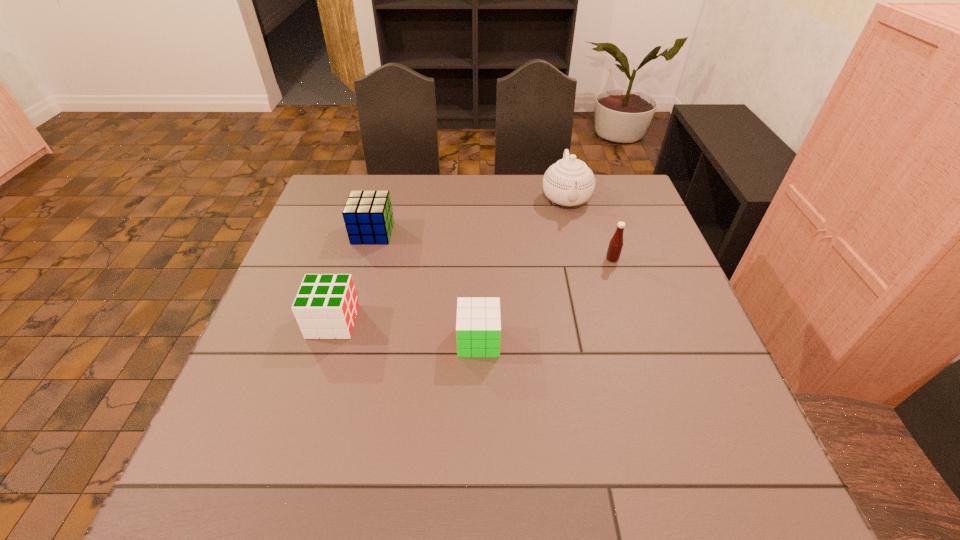
The image size is (960, 540). Find the location of `vacant area that lies between the chinaware and the third object from right to left`. vacant area that lies between the chinaware and the third object from right to left is located at coordinates (522, 269).

This screenshot has height=540, width=960. In order to click on free space that is in between the third nearest object and the rightmost cube in this screenshot , I will do (x=545, y=300).

Where is `vacant space in between the second farthest object and the farthest object`? Image resolution: width=960 pixels, height=540 pixels. vacant space in between the second farthest object and the farthest object is located at coordinates (469, 215).

In order to click on free space that is in between the farthest object and the farthest cube in this screenshot , I will do `click(469, 215)`.

At what (x,y) coordinates should I click in order to perform the action: click on free space between the farthest cube and the Tabasco sauce. Please return your answer as a coordinate pair (x, y). Image resolution: width=960 pixels, height=540 pixels. Looking at the image, I should click on (492, 246).

Identify the location of vacant space in between the Tabasco sauce and the rightmost cube. [x=545, y=300].

Select which object is the third closest to the second farthest object. Please provide its 2D coordinates. Your answer should be formatted as a tuple, i.e. [(x, y)], where the tuple contains the x and y coordinates of a point satisfying the conditions above.

[(569, 182)]

Locate which object ranks second in proximity to the farthest cube. Please provide its 2D coordinates. Your answer should be formatted as a tuple, i.e. [(x, y)], where the tuple contains the x and y coordinates of a point satisfying the conditions above.

[(478, 321)]

The image size is (960, 540). Find the location of `cube that stands as the closest to the second farthest object`. cube that stands as the closest to the second farthest object is located at coordinates (326, 305).

Find the location of a particular element. Image resolution: width=960 pixels, height=540 pixels. cube that is the second closest to the farthest cube is located at coordinates (478, 321).